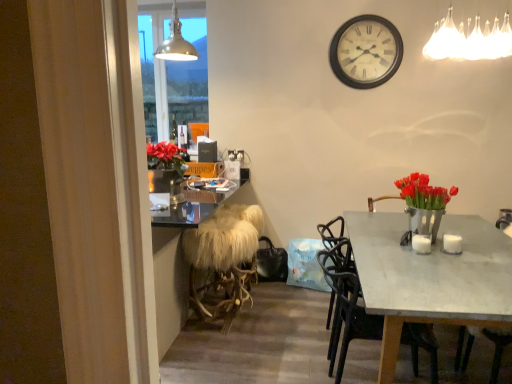
The image size is (512, 384). I want to click on vacant space that is in between white glossy coffee cup at right, the 1th coffee cup in the left-to-right sequence, and white glossy coffee cup at table right, the second coffee cup positioned from the left, so click(439, 245).